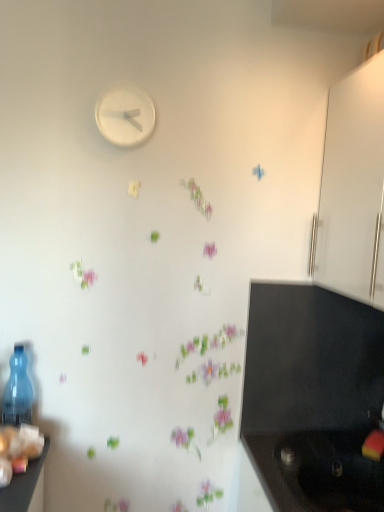
Where is `transparent plastic bottle at left`? transparent plastic bottle at left is located at coordinates (17, 391).

Image resolution: width=384 pixels, height=512 pixels. What do you see at coordinates (125, 116) in the screenshot?
I see `white matte clock at upper center` at bounding box center [125, 116].

Find the location of `transparent plastic bottle at left`. transparent plastic bottle at left is located at coordinates (17, 391).

From the image's perspective, is white glossy cabinet at right over black matte sink at lower right?

Correct, white glossy cabinet at right appears higher than black matte sink at lower right in the image.

Who is taller, white glossy cabinet at right or black matte sink at lower right?

Answer: white glossy cabinet at right is taller.

Is the surface of white glossy cabinet at right in direct contact with black matte sink at lower right?

No, white glossy cabinet at right is not beside black matte sink at lower right.

Is white glossy cabinet at right closer to the viewer compared to black matte sink at lower right?

Yes, it is in front of black matte sink at lower right.

Which of these two, transparent plastic bottle at left or white matte clock at upper center, is wider?

Wider between the two is transparent plastic bottle at left.

The image size is (384, 512). I want to click on bottle on the left of white matte clock at upper center, so click(17, 391).

From the image's perspective, which is above, transparent plastic bottle at left or white matte clock at upper center?

white matte clock at upper center, from the image's perspective.

Is transparent plastic bottle at left turned away from white matte clock at upper center?

transparent plastic bottle at left does not have its back to white matte clock at upper center.

From the image's perspective, who appears lower, black matte sink at lower right or white glossy cabinet at right?

Result: black matte sink at lower right appears lower in the image.

Who is smaller, black matte sink at lower right or white glossy cabinet at right?

Smaller between the two is black matte sink at lower right.

Considering the sizes of black matte sink at lower right and white glossy cabinet at right in the image, is black matte sink at lower right wider or thinner than white glossy cabinet at right?

black matte sink at lower right is wider than white glossy cabinet at right.

Does point (366, 486) come farther from viewer compared to point (327, 166)?

No, it is in front of (327, 166).

Is white matte clock at upper center not close to transparent plastic bottle at left?

white matte clock at upper center is actually quite close to transparent plastic bottle at left.

Which is correct: white matte clock at upper center is inside transparent plastic bottle at left, or outside of it?

white matte clock at upper center is spatially situated outside transparent plastic bottle at left.

Consider the image. Between white matte clock at upper center and transparent plastic bottle at left, which one has less height?

With less height is white matte clock at upper center.

From a real-world perspective, is white matte clock at upper center above or below transparent plastic bottle at left?

In terms of real-world spatial position, white matte clock at upper center is above transparent plastic bottle at left.

Considering the relative sizes of white matte clock at upper center and black matte sink at lower right in the image provided, is white matte clock at upper center thinner than black matte sink at lower right?

Yes.

Between point (104, 112) and point (329, 493), which one is positioned in front?

The point (104, 112) is closer.

In the scene shown: From a real-world perspective, is white matte clock at upper center positioned above or below black matte sink at lower right?

Clearly, from a real-world perspective, white matte clock at upper center is above black matte sink at lower right.

Could you tell me if white matte clock at upper center is turned towards black matte sink at lower right?

No, white matte clock at upper center is not aimed at black matte sink at lower right.

Between white glossy cabinet at right and white matte clock at upper center, which one has less height?

Standing shorter between the two is white matte clock at upper center.

Consider the image. How different are the orientations of white glossy cabinet at right and white matte clock at upper center in degrees?

There is a 88.4-degree angle between the facing directions of white glossy cabinet at right and white matte clock at upper center.

Can you confirm if white glossy cabinet at right is wider than white matte clock at upper center?

Yes.

From the image's perspective, is white glossy cabinet at right beneath white matte clock at upper center?

Yes, from the image's perspective, white glossy cabinet at right is below white matte clock at upper center.

Looking at this image, are white glossy cabinet at right and transparent plastic bottle at left making contact?

No.

Is white glossy cabinet at right inside the boundaries of transparent plastic bottle at left, or outside?

white glossy cabinet at right is not inside transparent plastic bottle at left, it's outside.

Consider the image. Which object is further away from the camera, white glossy cabinet at right or transparent plastic bottle at left?

transparent plastic bottle at left is further from the camera.

Which object is thinner, white glossy cabinet at right or transparent plastic bottle at left?

Thinner between the two is transparent plastic bottle at left.

Locate an element on the screen. The image size is (384, 512). cabinetry above the black matte sink at lower right (from a real-world perspective) is located at coordinates (353, 187).

Where is `bottle in front of the white matte clock at upper center`? bottle in front of the white matte clock at upper center is located at coordinates (17, 391).

Based on their spatial positions, is white glossy cabinet at right or transparent plastic bottle at left closer to black matte sink at lower right?

white glossy cabinet at right is positioned closer to the anchor black matte sink at lower right.

Estimate the real-world distances between objects in this image. Which object is further from black matte sink at lower right, transparent plastic bottle at left or white matte clock at upper center?

The object further to black matte sink at lower right is white matte clock at upper center.

Considering their positions, is white glossy cabinet at right positioned closer to transparent plastic bottle at left than white matte clock at upper center?

white matte clock at upper center is positioned closer to the anchor transparent plastic bottle at left.

Considering their positions, is white matte clock at upper center positioned closer to transparent plastic bottle at left than black matte sink at lower right?

Based on the image, white matte clock at upper center appears to be nearer to transparent plastic bottle at left.

Looking at the image, which one is located closer to white glossy cabinet at right, white matte clock at upper center or transparent plastic bottle at left?

The object closer to white glossy cabinet at right is white matte clock at upper center.

Based on the photo, when comparing their distances from white matte clock at upper center, does transparent plastic bottle at left or black matte sink at lower right seem further?

Among the two, black matte sink at lower right is located further to white matte clock at upper center.

Looking at the image, which one is located closer to white matte clock at upper center, black matte sink at lower right or transparent plastic bottle at left?

Based on the image, transparent plastic bottle at left appears to be nearer to white matte clock at upper center.

Based on the photo, from the image, which object appears to be farther from white glossy cabinet at right, transparent plastic bottle at left or black matte sink at lower right?

transparent plastic bottle at left is further to white glossy cabinet at right.

Locate an element on the screen. This screenshot has height=512, width=384. cabinetry between white matte clock at upper center and black matte sink at lower right from top to bottom is located at coordinates (353, 187).

Find the location of a particular element. The width and height of the screenshot is (384, 512). clock between transparent plastic bottle at left and white glossy cabinet at right in the horizontal direction is located at coordinates (125, 116).

This screenshot has height=512, width=384. I want to click on sink between transparent plastic bottle at left and white glossy cabinet at right, so click(330, 471).

Where is `bottle between white matte clock at upper center and black matte sink at lower right from top to bottom`? bottle between white matte clock at upper center and black matte sink at lower right from top to bottom is located at coordinates (17, 391).